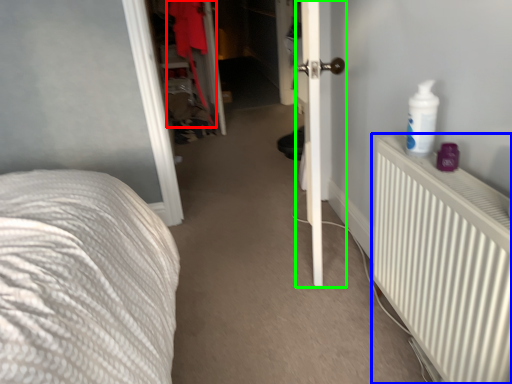
Question: Which object is positioned closest to clothing (highlighted by a red box)? Select from radiator (highlighted by a blue box) and door (highlighted by a green box).

Choices:
 (A) radiator
 (B) door

Answer: (B)